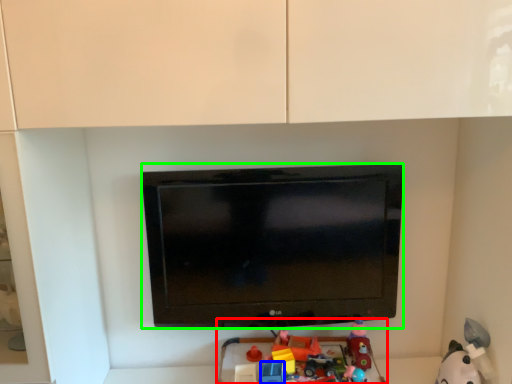
Question: Based on their relative distances, which object is nearer to toy (highlighted by a red box)? Choose from toy (highlighted by a blue box) and television (highlighted by a green box).

Choices:
 (A) toy
 (B) television

Answer: (A)